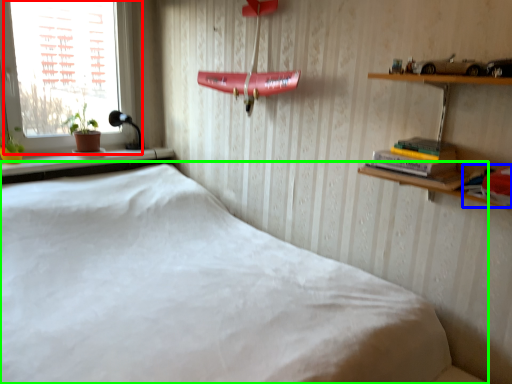
Question: Based on their relative distances, which object is nearer to window (highlighted by a red box)? Choose from book (highlighted by a blue box) and bed (highlighted by a green box).

Choices:
 (A) book
 (B) bed

Answer: (B)